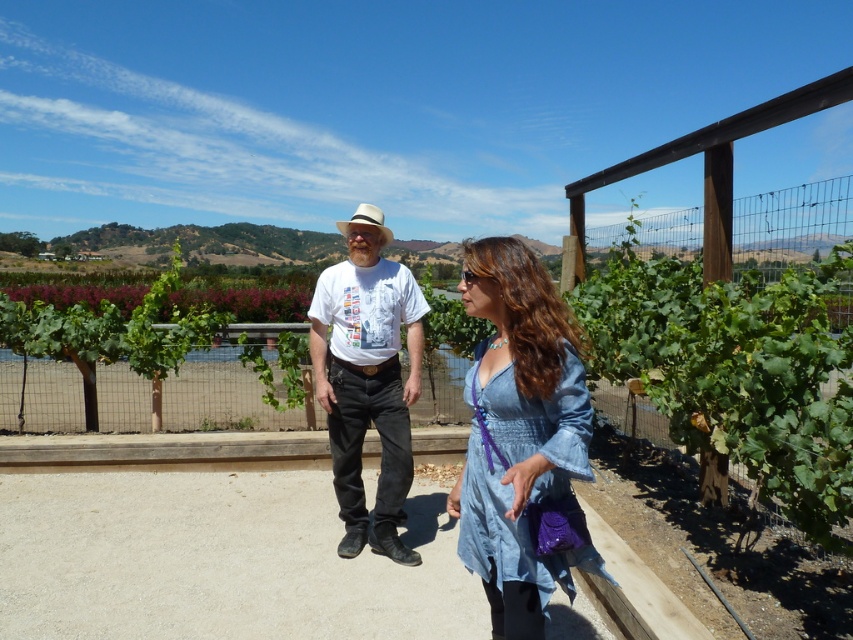
Question: Among these objects, which one is farthest from the camera?

Choices:
 (A) denim dress at center
 (B) white cotton shirt at center

Answer: (B)

Question: From the image, what is the correct spatial relationship of denim dress at center in relation to white cotton shirt at center?

Choices:
 (A) left
 (B) right

Answer: (B)

Question: Which is nearer to the white cotton shirt at center?

Choices:
 (A) light gray concrete at center
 (B) denim dress at center

Answer: (A)

Question: Which point is farther to the camera?

Choices:
 (A) (424, 500)
 (B) (492, 248)
 (C) (343, 554)

Answer: (A)

Question: Can you confirm if light gray concrete at center is smaller than denim dress at center?

Choices:
 (A) no
 (B) yes

Answer: (A)

Question: Is denim dress at center below white cotton shirt at center?

Choices:
 (A) yes
 (B) no

Answer: (A)